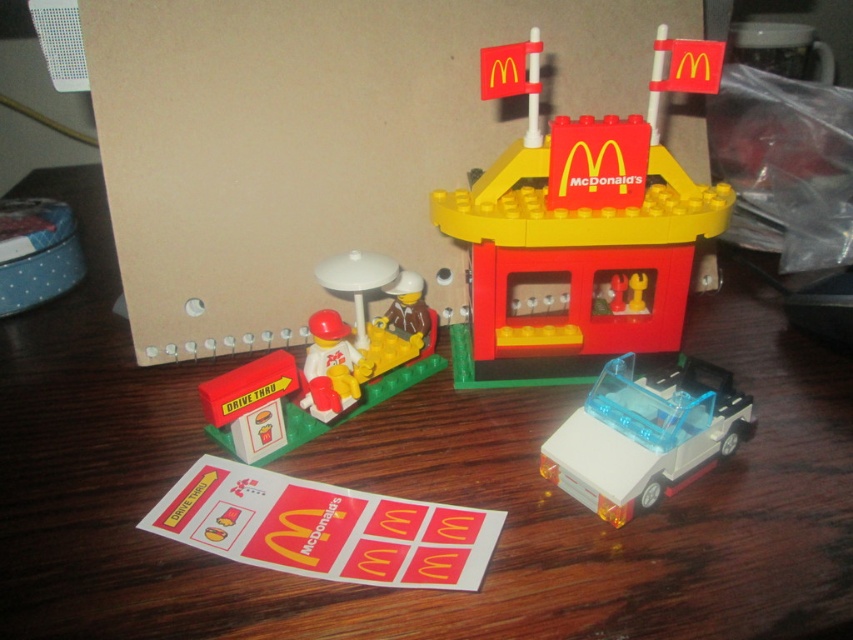
Question: Considering the real-world distances, which object is farthest from the brick-like mcdonald's building at center?

Choices:
 (A) yellow matte umbrella at center
 (B) wooden table at center
 (C) white matte figure at center
 (D) white translucent plastic car at lower right

Answer: (C)

Question: Can you confirm if yellow matte umbrella at center is positioned above white matte figure at center?

Choices:
 (A) no
 (B) yes

Answer: (B)

Question: Can you confirm if brick-like mcdonald's building at center is positioned to the left of white matte figure at center?

Choices:
 (A) yes
 (B) no

Answer: (B)

Question: Can you confirm if brick-like mcdonald's building at center is smaller than yellow matte umbrella at center?

Choices:
 (A) yes
 (B) no

Answer: (B)

Question: Which object is the closest to the white matte figure at center?

Choices:
 (A) brick-like mcdonald's building at center
 (B) white translucent plastic car at lower right
 (C) yellow matte umbrella at center

Answer: (C)

Question: Which of the following is the farthest from the observer?

Choices:
 (A) (216, 387)
 (B) (563, 472)

Answer: (A)